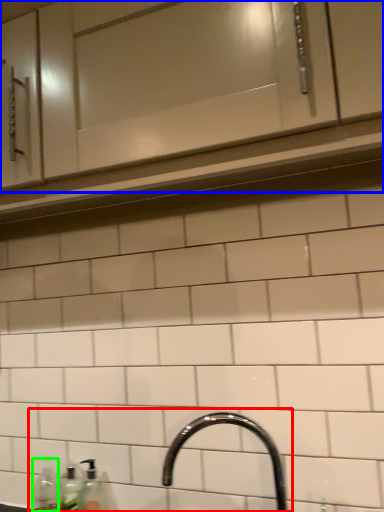
Question: Based on their relative distances, which object is nearer to sink (highlighted by a red box)? Choose from cabinetry (highlighted by a blue box) and bottle (highlighted by a green box).

Choices:
 (A) cabinetry
 (B) bottle

Answer: (B)